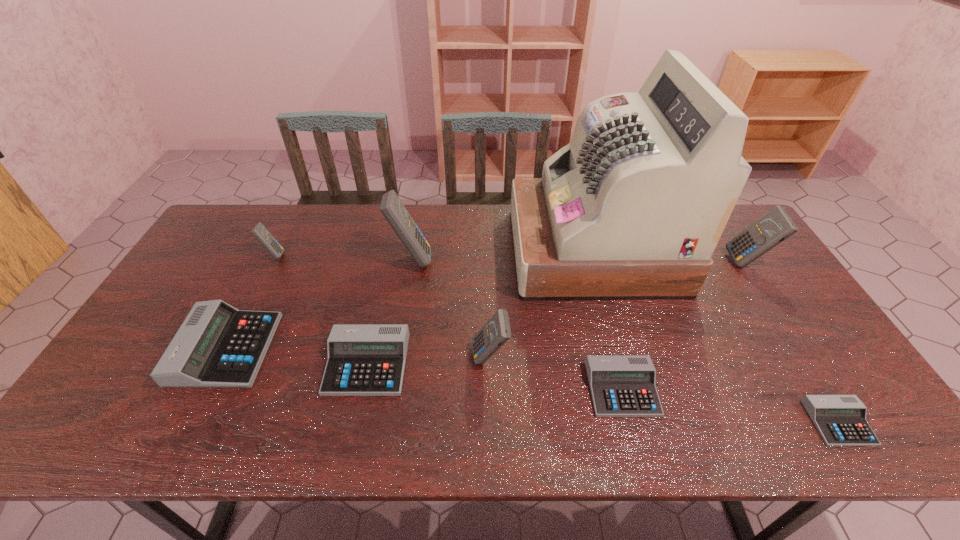
Find the location of `vacant space located 0.280m on the left of the eighth tallest object`. vacant space located 0.280m on the left of the eighth tallest object is located at coordinates (474, 389).

Find the location of a particular element. vacant space located on the back of the shortest calculator is located at coordinates (803, 366).

The width and height of the screenshot is (960, 540). In order to click on cash register present at the far edge in this screenshot , I will do `click(633, 207)`.

Identify the location of calculator positioned at the far edge. The height and width of the screenshot is (540, 960). (392, 208).

This screenshot has width=960, height=540. What are the coordinates of `object at the left edge` in the screenshot? It's located at (217, 346).

In order to click on object at the near right corner in this screenshot , I will do `click(840, 420)`.

The width and height of the screenshot is (960, 540). I want to click on vacant region at the far edge of the desktop, so click(x=326, y=243).

Find the location of a particular element. Image resolution: width=960 pixels, height=540 pixels. vacant area at the near edge is located at coordinates [750, 422].

The image size is (960, 540). In the image, there is a desktop. Find the location of `vacant space at the right edge`. vacant space at the right edge is located at coordinates (827, 379).

The height and width of the screenshot is (540, 960). I want to click on vacant space at the near left corner, so click(x=126, y=443).